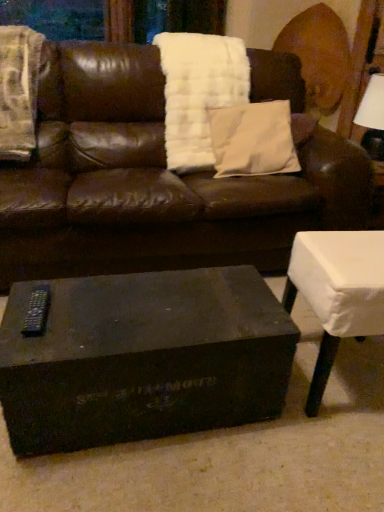
Locate an element on the screen. free point above white cloth-covered table at lower right (from a real-world perspective) is located at coordinates (353, 252).